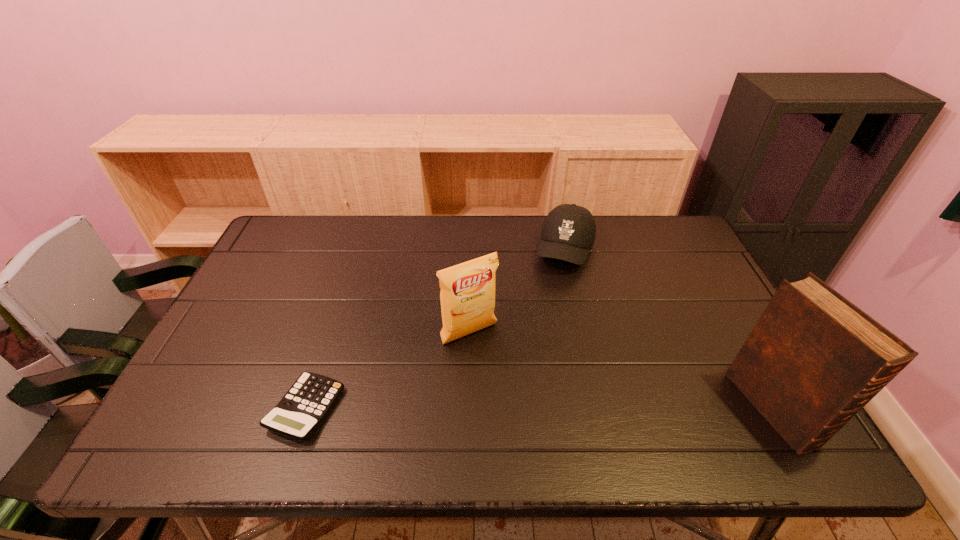
Image resolution: width=960 pixels, height=540 pixels. What are the coordinates of `object located at the near right corner` in the screenshot? It's located at (813, 360).

This screenshot has height=540, width=960. What are the coordinates of `vacant region at the far edge of the desktop` in the screenshot? It's located at (352, 218).

This screenshot has height=540, width=960. In order to click on vacant region at the near edge in this screenshot , I will do `click(681, 404)`.

Locate an element on the screen. vacant area at the left edge is located at coordinates (260, 282).

In the image, there is a desktop. In order to click on vacant space at the right edge in this screenshot , I will do `click(673, 275)`.

Identify the location of vacant area at the near left corner of the desktop. This screenshot has height=540, width=960. (177, 414).

I want to click on vacant space in between the third tallest object and the second farthest object, so click(517, 292).

The height and width of the screenshot is (540, 960). I want to click on empty space that is in between the third object from right to left and the Bible, so click(x=620, y=371).

At what (x,y) coordinates should I click in order to perform the action: click on free spot between the calculator and the Bible. Please return your answer as a coordinate pair (x, y). Image resolution: width=960 pixels, height=540 pixels. Looking at the image, I should click on (539, 408).

The width and height of the screenshot is (960, 540). What are the coordinates of `vacant region between the leftmost object and the third shortest object` in the screenshot? It's located at (388, 372).